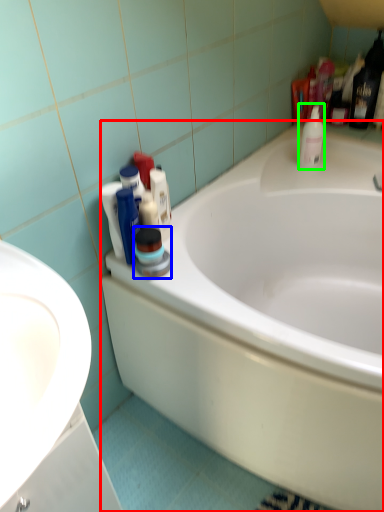
Question: Which object is positioned closest to bathtub (highlighted by a red box)? Select from cleaning product (highlighted by a blue box) and cleaning product (highlighted by a green box).

Choices:
 (A) cleaning product
 (B) cleaning product

Answer: (A)